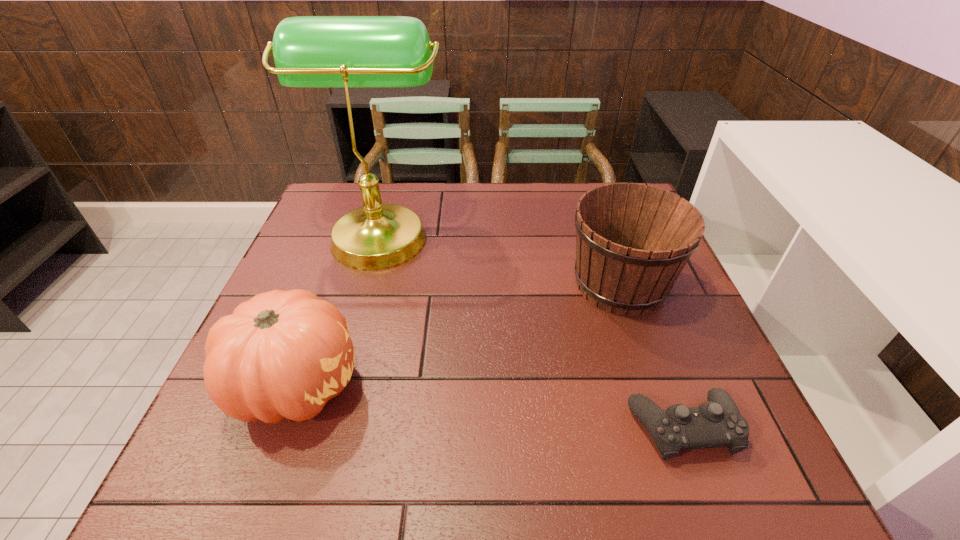
At what (x,y) coordinates should I click in order to perform the action: click on free location that satisfies the following two spatial constraints: 1. on the desk next to the lamp; 2. on the back side of the wine bucket. Please return your answer as a coordinate pair (x, y). This screenshot has width=960, height=540. Looking at the image, I should click on (367, 284).